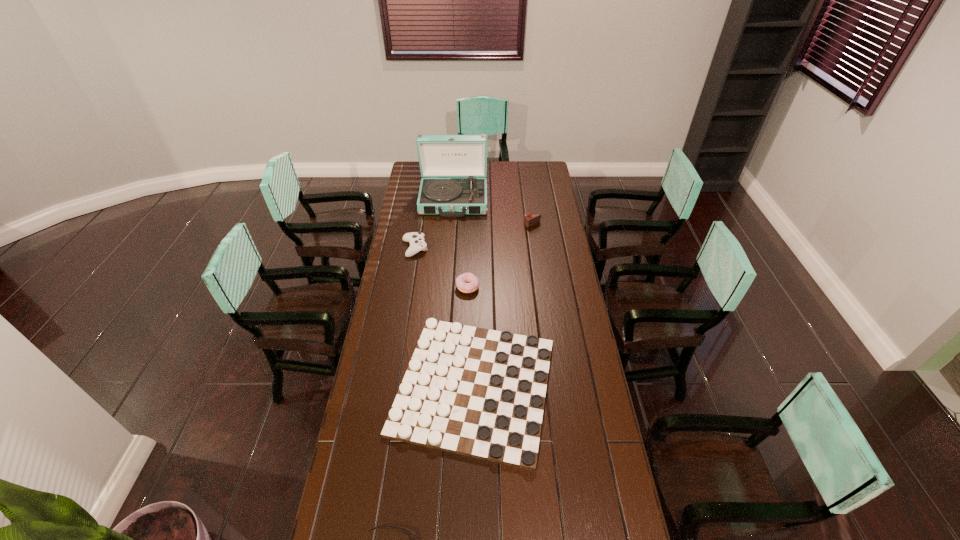
The width and height of the screenshot is (960, 540). I want to click on empty space that is in between the gameboard and the fifth nearest object, so click(x=503, y=306).

At what (x,y) coordinates should I click in order to perform the action: click on unoccupied area between the control and the doughnut. Please return your answer as a coordinate pair (x, y). Image resolution: width=960 pixels, height=540 pixels. Looking at the image, I should click on [x=442, y=268].

The width and height of the screenshot is (960, 540). Find the location of `free point between the control and the chocolate cake`. free point between the control and the chocolate cake is located at coordinates (473, 237).

Find the location of a particular element. Image resolution: width=960 pixels, height=540 pixels. free space between the control and the fourth farthest object is located at coordinates click(x=442, y=268).

Image resolution: width=960 pixels, height=540 pixels. Identify the location of unoccupied position between the control and the chocolate cake. pyautogui.click(x=473, y=237).

You are a GUI agent. You are given a task and a screenshot of the screen. Output one action in this format:
    pyautogui.click(x=<x>, y=<y>)
    Task: Click on the free space between the shortest object and the farthest object
    The image size is (960, 540).
    Given the screenshot: What is the action you would take?
    tap(464, 293)

This screenshot has height=540, width=960. I want to click on vacant space that is in between the fifth nearest object and the gameboard, so click(x=503, y=306).

Choose which object is the fourth nearest neighbor to the nearest object. Please provide its 2D coordinates. Your answer should be formatted as a tuple, i.e. [(x, y)], where the tuple contains the x and y coordinates of a point satisfying the conditions above.

[(530, 219)]

I want to click on object that stands as the fifth closest to the doughnut, so click(405, 530).

At what (x,y) coordinates should I click in order to perform the action: click on free space that satisfies the following two spatial constraints: 1. on the face side of the record player; 2. on the left side of the fifth farthest object. Please return your answer as a coordinate pair (x, y). Looking at the image, I should click on (440, 386).